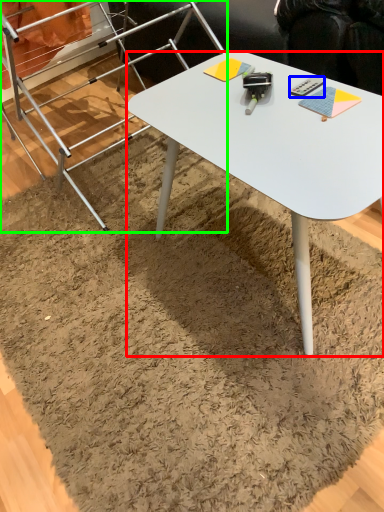
Question: Which object is the farthest from desk (highlighted by a red box)? Choose among these: remote control (highlighted by a blue box) or ladder (highlighted by a green box).

Choices:
 (A) remote control
 (B) ladder

Answer: (B)